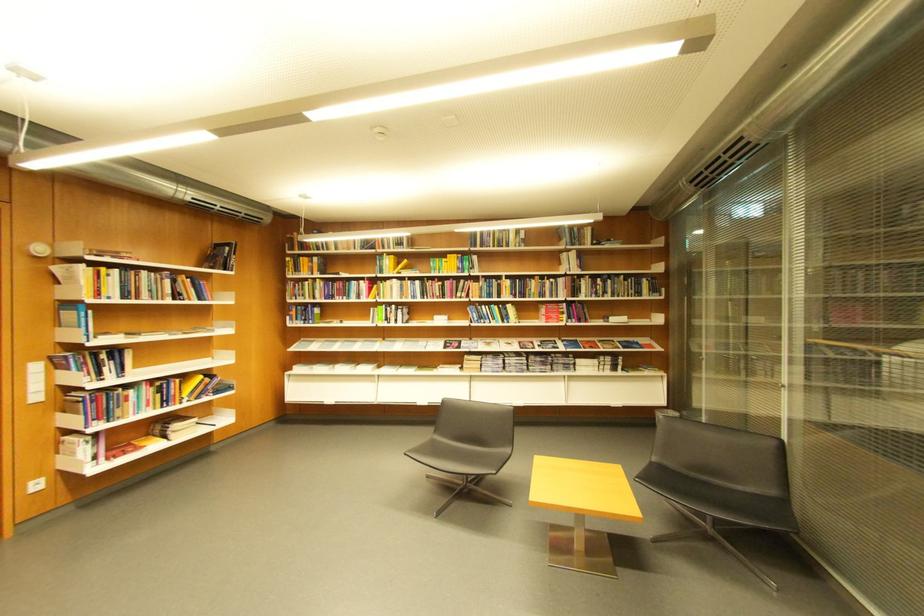
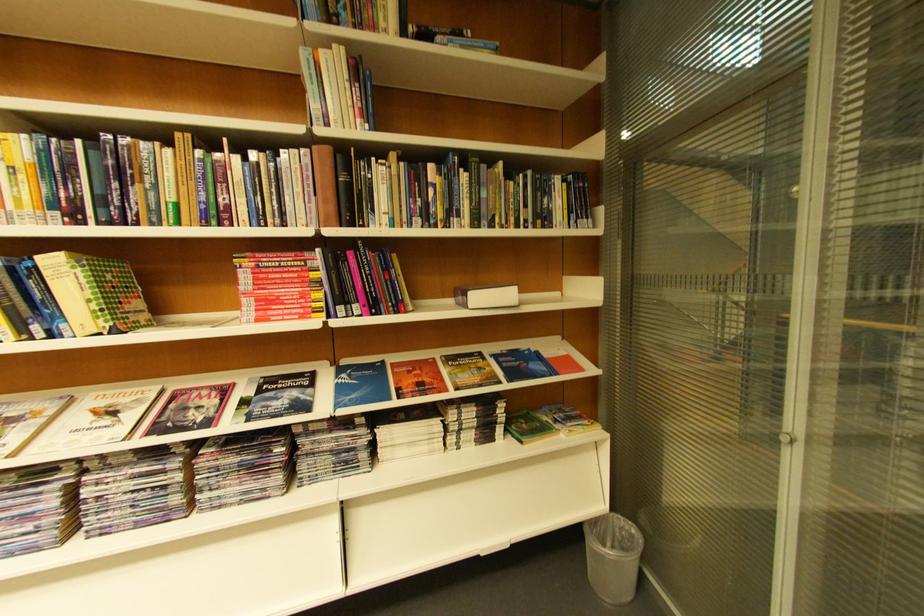
Locate, in the second image, the point that corresponds to [539,342] in the first image.

(224, 389)